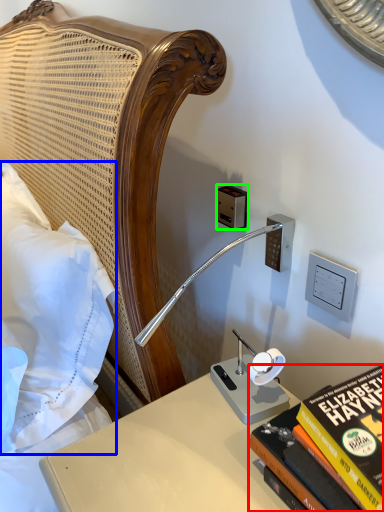
Question: Which object is the farthest from book (highlighted by a red box)? Choose among these: pillow (highlighted by a blue box) or electric outlet (highlighted by a green box).

Choices:
 (A) pillow
 (B) electric outlet

Answer: (A)